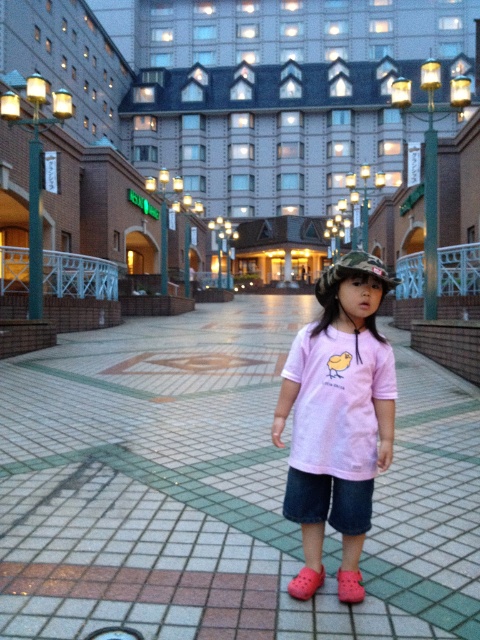
What do you see at coordinates (242, 86) in the screenshot? I see `pink cotton shirt at center` at bounding box center [242, 86].

Does pink cotton shirt at center appear over denim shorts at center?

Yes, pink cotton shirt at center is above denim shorts at center.

Image resolution: width=480 pixels, height=640 pixels. What do you see at coordinates (242, 86) in the screenshot? I see `pink cotton shirt at center` at bounding box center [242, 86].

This screenshot has height=640, width=480. Find the location of `pink cotton shirt at center`. pink cotton shirt at center is located at coordinates (242, 86).

Can you confirm if pink croc shoes at lower center is positioned below pink rubber shoe at lower center?

Yes.

Is point (324, 577) more distant than point (346, 570)?

Yes, it is.

Image resolution: width=480 pixels, height=640 pixels. Identify the location of pink croc shoes at lower center. (305, 582).

Is point (219, 90) positioned in front of point (346, 429)?

That is False.

Can you confirm if pink cotton shirt at center is positioned to the left of pink matte shirt at center?

In fact, pink cotton shirt at center is to the right of pink matte shirt at center.

This screenshot has height=640, width=480. Describe the element at coordinates (242, 86) in the screenshot. I see `pink cotton shirt at center` at that location.

Where is `pink cotton shirt at center`? The height and width of the screenshot is (640, 480). pink cotton shirt at center is located at coordinates (242, 86).